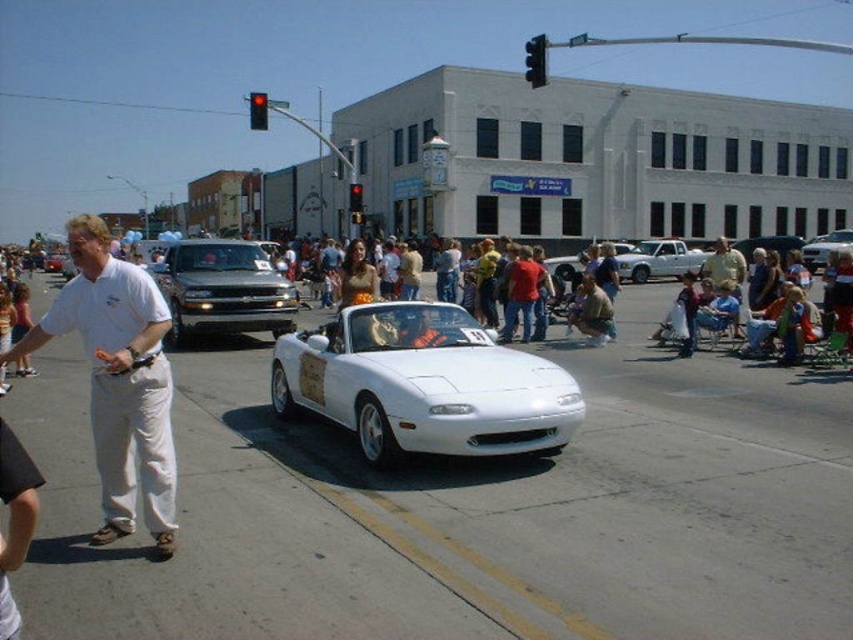
Question: Does white glossy sports car at center appear under red glass traffic light at center?

Choices:
 (A) no
 (B) yes

Answer: (B)

Question: Does white glossy sports car at center have a smaller size compared to red plastic traffic light at upper center?

Choices:
 (A) yes
 (B) no

Answer: (A)

Question: Which of these objects is positioned farthest from the white glossy convertible at center?

Choices:
 (A) red plastic traffic light at upper center
 (B) red glass traffic light at center

Answer: (A)

Question: Which point is closer to the camera?

Choices:
 (A) black plastic traffic light at upper center
 (B) white glossy sports car at center
 (C) white glossy convertible at center
 (D) red glass traffic light at center

Answer: (B)

Question: Which point appears farthest from the camera in this image?

Choices:
 (A) (363, 209)
 (B) (252, 96)
 (C) (149, 490)

Answer: (B)

Question: Is white cotton shirt at left further to camera compared to matte black truck at center?

Choices:
 (A) yes
 (B) no

Answer: (B)